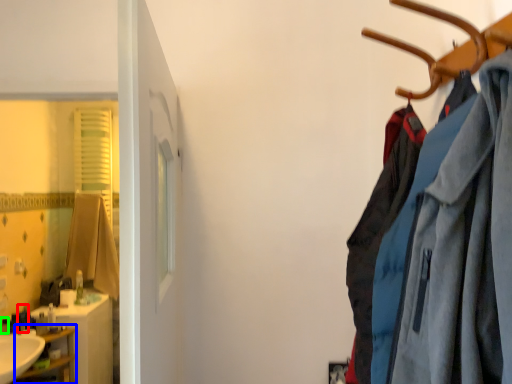
Question: Based on their relative distances, which object is farther from toiletry (highlighted by a red box)? Choose from shelf (highlighted by a blue box) and toiletry (highlighted by a green box).

Choices:
 (A) shelf
 (B) toiletry

Answer: (A)